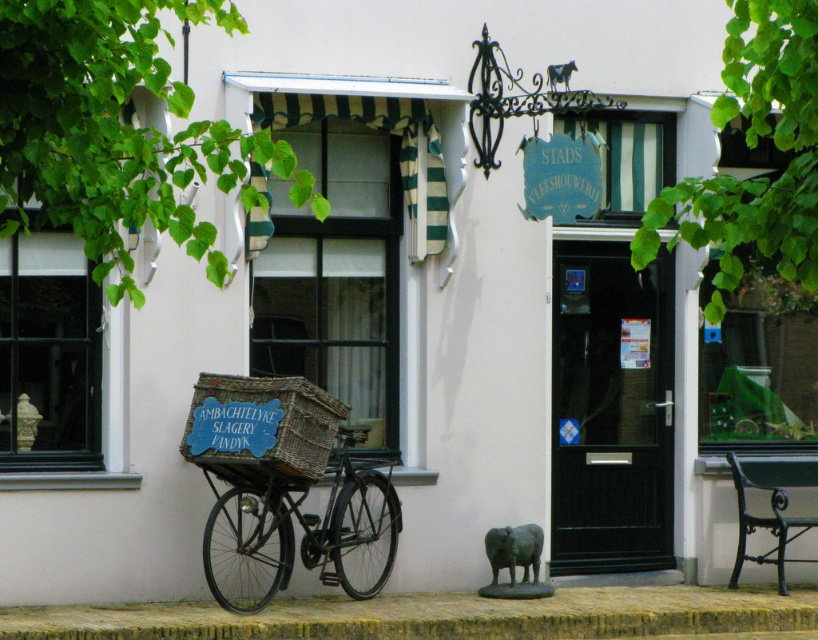
You are standing in front of the store and want to touch both points on the building facade. Which point should you reach for first, the point at coordinate (286, 490) or the point at coordinate (264, 442)?

You should reach for the point at coordinate (286, 490) first because it is closer to you than the point at coordinate (264, 442).

You are standing in front of the store and need to place a small package on the brick at lower center and the black matte bicycle at center. Which object should you place the package on if you want it to be closer to the ground?

The brick at lower center is closer to the viewer than the black matte bicycle at center, so placing the package on the brick at lower center would make it closer to the ground.